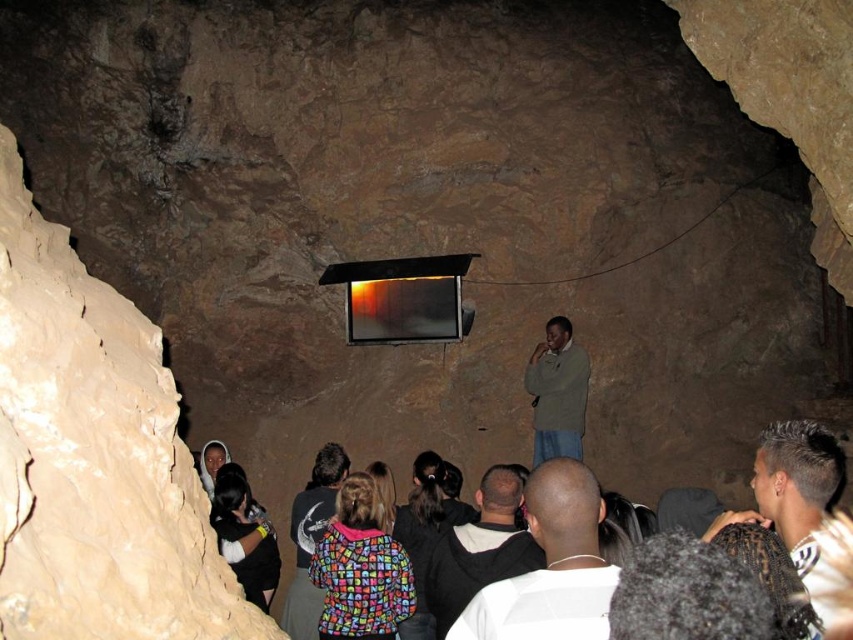
Which is below, dark brown hair at center or dark gray shirt at center?

dark gray shirt at center

Which of these two, dark brown hair at center or dark gray shirt at center, stands taller?

dark gray shirt at center

The width and height of the screenshot is (853, 640). What do you see at coordinates (799, 496) in the screenshot?
I see `dark brown hair at center` at bounding box center [799, 496].

The width and height of the screenshot is (853, 640). I want to click on dark brown hair at center, so click(x=799, y=496).

Where is `dark gray shirt at center`? This screenshot has width=853, height=640. dark gray shirt at center is located at coordinates pos(479,548).

Is dark gray shirt at center above multicolored fabric crowd at center?

No.

In order to click on dark gray shirt at center in this screenshot , I will do `click(479, 548)`.

At what (x,y) coordinates should I click in order to perform the action: click on dark gray shirt at center. Please return your answer as a coordinate pair (x, y). The width and height of the screenshot is (853, 640). Looking at the image, I should click on (479, 548).

Who is taller, dark gray shirt at center or green matte jacket at center?

green matte jacket at center is taller.

Is point (469, 577) positioned before point (567, 436)?

Yes, it is.

The width and height of the screenshot is (853, 640). What are the coordinates of `dark gray shirt at center` in the screenshot? It's located at (479, 548).